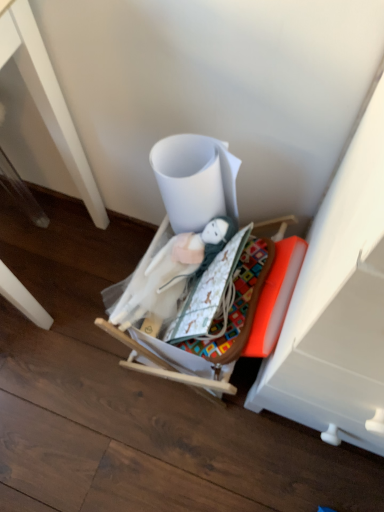
I want to click on free location in front of white wood rocking chair at lower left, so click(x=60, y=376).